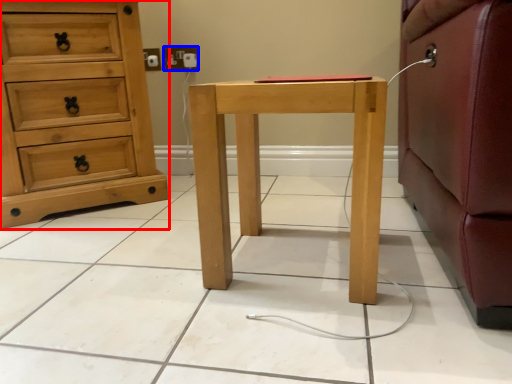
Question: Which of the following is the closest to the observer, chest of drawers (highlighted by a red box) or electric outlet (highlighted by a blue box)?

Choices:
 (A) chest of drawers
 (B) electric outlet

Answer: (A)